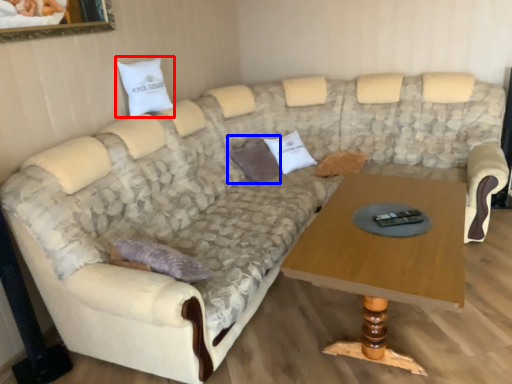
Question: Among these objects, which one is nearest to the camera, pillow (highlighted by a red box) or pillow (highlighted by a blue box)?

Choices:
 (A) pillow
 (B) pillow

Answer: (A)